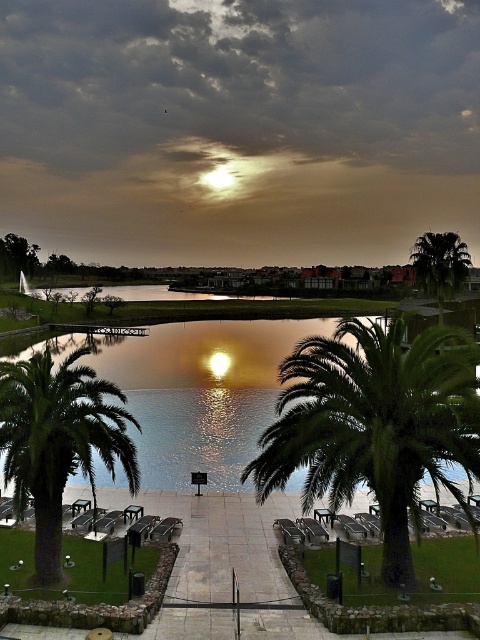
Question: Does smooth concrete path at center lie behind green leafy palm tree at upper right?

Choices:
 (A) yes
 (B) no

Answer: (B)

Question: Which point is closer to the camera?

Choices:
 (A) smooth concrete path at center
 (B) green leafy palm tree at upper right
 (C) green leafy palm tree at lower left
 (D) green leafy palm tree at center

Answer: (A)

Question: Does green leafy palm tree at center have a smaller size compared to green leafy palm tree at upper right?

Choices:
 (A) yes
 (B) no

Answer: (A)

Question: Considering the relative positions of smooth concrete path at center and green leafy palm tree at upper right in the image provided, where is smooth concrete path at center located with respect to green leafy palm tree at upper right?

Choices:
 (A) below
 (B) above

Answer: (A)

Question: Which of these objects is positioned farthest from the green leafy palm tree at lower left?

Choices:
 (A) green leafy palm tree at center
 (B) smooth concrete path at center

Answer: (A)

Question: Which point appears closest to the camera in this image?

Choices:
 (A) (458, 268)
 (B) (170, 616)

Answer: (B)